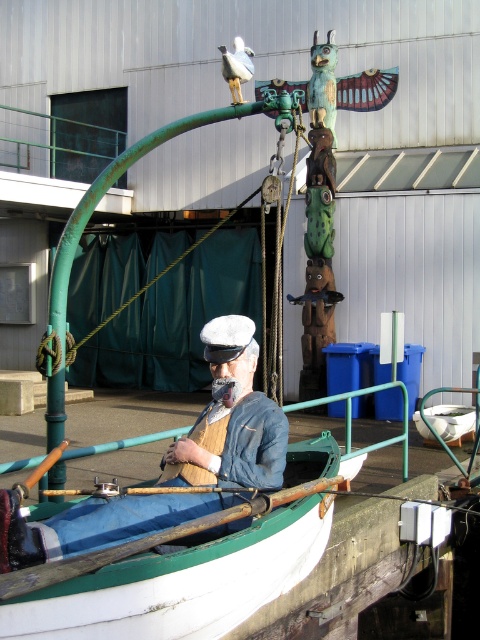
Question: Which object is the closest to the white painted wood boat at center?

Choices:
 (A) denim jacket at center
 (B) white matte bird at upper center
 (C) green patina totem pole at upper center

Answer: (A)

Question: Based on their relative distances, which object is farther from the green patina totem pole at upper center?

Choices:
 (A) denim jacket at center
 (B) white matte bird at upper center

Answer: (A)

Question: Is denim jacket at center to the left of white matte bird at upper center from the viewer's perspective?

Choices:
 (A) yes
 (B) no

Answer: (A)

Question: Which point is farther to the camera?

Choices:
 (A) (204, 611)
 (B) (51, 548)
 (C) (236, 61)

Answer: (C)

Question: Does denim jacket at center appear over white matte bird at upper center?

Choices:
 (A) no
 (B) yes

Answer: (A)

Question: Can you confirm if white painted wood boat at center is positioned above white matte bird at upper center?

Choices:
 (A) no
 (B) yes

Answer: (A)